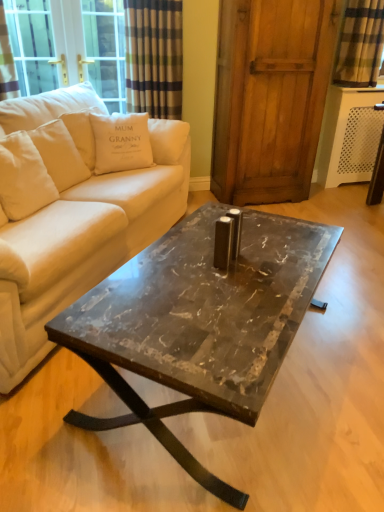
You are a GUI agent. You are given a task and a screenshot of the screen. Output one action in this format:
    pyautogui.click(x=<x>, y=<y>)
    Task: Click on the unoccupied region to the right of wooden screen door at center
    
    Given the screenshot: What is the action you would take?
    pos(331,203)